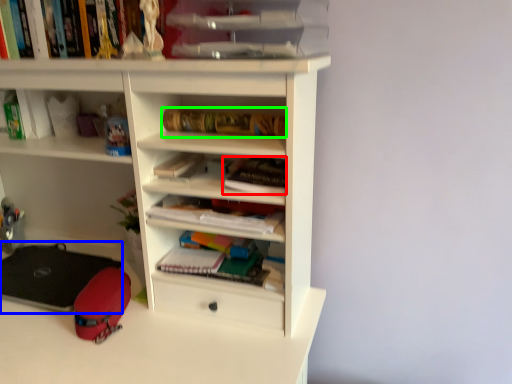
Question: Estimate the real-world distances between objects in this image. Which object is closer to book (highlighted by a red box), equipment (highlighted by a blue box) or book (highlighted by a green box)?

Choices:
 (A) equipment
 (B) book

Answer: (B)